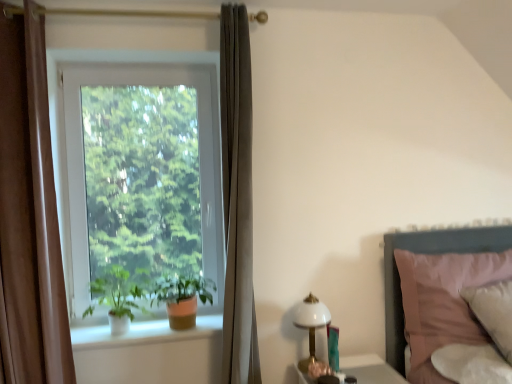
The width and height of the screenshot is (512, 384). Describe the element at coordinates (370, 369) in the screenshot. I see `white glossy table at lower right` at that location.

The width and height of the screenshot is (512, 384). What do you see at coordinates (142, 172) in the screenshot?
I see `white plastic window at left` at bounding box center [142, 172].

What is the approximate width of brown velvet curtain at left?

20.61 centimeters.

The height and width of the screenshot is (384, 512). In order to click on white ceramic window sill at lower left in this screenshot , I will do `click(143, 333)`.

Image resolution: width=512 pixels, height=384 pixels. I want to click on pink fabric bed at right, so click(428, 252).

What is the approximate width of white glass lampshade at right?

The width of white glass lampshade at right is 18.99 centimeters.

Where is `white glass lampshade at right`? This screenshot has width=512, height=384. white glass lampshade at right is located at coordinates [311, 324].

What do you see at coordinates (182, 297) in the screenshot? This screenshot has width=512, height=384. I see `green matte plant at window, positioned as the first houseplant in right-to-left order` at bounding box center [182, 297].

Identify the location of white matte plant at window, which is the second houseplant in right-to-left order. Image resolution: width=512 pixels, height=384 pixels. (118, 297).

Where is `white glossy table at lower right`? Image resolution: width=512 pixels, height=384 pixels. white glossy table at lower right is located at coordinates (370, 369).

In the scene shown: Can you confirm if brown velvet curtain at left is shorter than white glossy table at lower right?

In fact, brown velvet curtain at left may be taller than white glossy table at lower right.

Does brown velvet curtain at left turn towards white glossy table at lower right?

No.

Based on their sizes in the image, would you say brown velvet curtain at left is bigger or smaller than white glossy table at lower right?

In the image, brown velvet curtain at left appears to be larger than white glossy table at lower right.

Is white glass lampshade at right shorter than white matte plant at window, the first houseplant when ordered from left to right?

No.

Is white glass lampshade at right looking in the opposite direction of white matte plant at window, which is the second houseplant in right-to-left order?

No, white glass lampshade at right's orientation is not away from white matte plant at window, which is the second houseplant in right-to-left order.

This screenshot has width=512, height=384. I want to click on bedside lamp to the right of white matte plant at window, which is the second houseplant in right-to-left order, so click(311, 324).

Is brown velvet curtain at left taller than green matte plant at window, positioned as the first houseplant in right-to-left order?

Yes, brown velvet curtain at left is taller than green matte plant at window, positioned as the first houseplant in right-to-left order.

Looking at this image, how distant is brown velvet curtain at left from green matte plant at window, which ranks as the second houseplant in left-to-right order?

brown velvet curtain at left is 27.41 inches away from green matte plant at window, which ranks as the second houseplant in left-to-right order.

Considering the sizes of objects brown velvet curtain at left and green matte plant at window, which ranks as the second houseplant in left-to-right order, in the image provided, who is thinner, brown velvet curtain at left or green matte plant at window, which ranks as the second houseplant in left-to-right order,?

brown velvet curtain at left is thinner.

Is the position of brown velvet curtain at left more distant than that of green matte plant at window, positioned as the first houseplant in right-to-left order?

No, it is in front of green matte plant at window, positioned as the first houseplant in right-to-left order.

Is white ceramic window sill at lower left facing towards white matte plant at window, the first houseplant when ordered from left to right?

No, white ceramic window sill at lower left is not turned towards white matte plant at window, the first houseplant when ordered from left to right.

Considering the sizes of objects white ceramic window sill at lower left and white matte plant at window, which is the second houseplant in right-to-left order, in the image provided, who is wider, white ceramic window sill at lower left or white matte plant at window, which is the second houseplant in right-to-left order,?

Wider between the two is white ceramic window sill at lower left.

Is white ceramic window sill at lower left inside or outside of white matte plant at window, the first houseplant when ordered from left to right?

white ceramic window sill at lower left is spatially situated outside white matte plant at window, the first houseplant when ordered from left to right.

Visually, is white ceramic window sill at lower left positioned to the left or to the right of white matte plant at window, which is the second houseplant in right-to-left order?

In the image, white ceramic window sill at lower left appears on the right side of white matte plant at window, which is the second houseplant in right-to-left order.

Is brown velvet curtain at left facing away from white matte plant at window, the first houseplant when ordered from left to right?

No.

Considering the points (16, 129) and (121, 322), which point is in front, point (16, 129) or point (121, 322)?

Positioned in front is point (16, 129).

Can you confirm if brown velvet curtain at left is wider than white matte plant at window, the first houseplant when ordered from left to right?

Incorrect, the width of brown velvet curtain at left does not surpass that of white matte plant at window, the first houseplant when ordered from left to right.

Considering the sizes of objects brown velvet curtain at left and white matte plant at window, which is the second houseplant in right-to-left order, in the image provided, who is smaller, brown velvet curtain at left or white matte plant at window, which is the second houseplant in right-to-left order,?

Smaller between the two is white matte plant at window, which is the second houseplant in right-to-left order.

You are a GUI agent. You are given a task and a screenshot of the screen. Output one action in this format:
    pyautogui.click(x=<x>, y=<y>)
    Task: Click on the table below the white ceramic window sill at lower left (from the image's perspective)
    Image resolution: width=512 pixels, height=384 pixels.
    Given the screenshot: What is the action you would take?
    pyautogui.click(x=370, y=369)

Is the depth of white ceramic window sill at lower left greater than that of white glossy table at lower right?

That is True.

Considering the sizes of white ceramic window sill at lower left and white glossy table at lower right in the image, is white ceramic window sill at lower left wider or thinner than white glossy table at lower right?

Considering their sizes, white ceramic window sill at lower left looks slimmer than white glossy table at lower right.

Which of these two, white ceramic window sill at lower left or white glossy table at lower right, stands shorter?

With less height is white glossy table at lower right.

Considering the positions of point (373, 372) and point (467, 229), is point (373, 372) closer or farther from the camera than point (467, 229)?

Point (373, 372).

Does white glossy table at lower right have a smaller size compared to pink fabric bed at right?

Yes, white glossy table at lower right is smaller than pink fabric bed at right.

Choose the correct answer: Is white glossy table at lower right inside pink fabric bed at right or outside it?

white glossy table at lower right is not enclosed by pink fabric bed at right.

Does white glossy table at lower right have a greater width compared to pink fabric bed at right?

Yes, white glossy table at lower right is wider than pink fabric bed at right.

Find the location of `table behind the brown velvet curtain at left`. table behind the brown velvet curtain at left is located at coordinates (370, 369).

Identify the location of the 2nd houseplant above the white glass lampshade at right (from a real-world perspective). The image size is (512, 384). (118, 297).

When comparing their distances from white ceramic window sill at lower left, does white glossy table at lower right or green matte plant at window, which ranks as the second houseplant in left-to-right order, seem closer?

The object closer to white ceramic window sill at lower left is green matte plant at window, which ranks as the second houseplant in left-to-right order.

Based on their spatial positions, is white ceramic window sill at lower left or pink fabric bed at right further from green matte plant at window, positioned as the first houseplant in right-to-left order?

The object further to green matte plant at window, positioned as the first houseplant in right-to-left order, is pink fabric bed at right.

Based on their spatial positions, is white glass lampshade at right or green matte plant at window, which ranks as the second houseplant in left-to-right order, further from brown velvet curtain at left?

A: Among the two, white glass lampshade at right is located further to brown velvet curtain at left.

Which object lies further to the anchor point white glossy table at lower right, white glass lampshade at right or white plastic window at left?

The object further to white glossy table at lower right is white plastic window at left.

Which object lies nearer to the anchor point green matte plant at window, which ranks as the second houseplant in left-to-right order, white ceramic window sill at lower left or white matte plant at window, the first houseplant when ordered from left to right?

white ceramic window sill at lower left is closer to green matte plant at window, which ranks as the second houseplant in left-to-right order.

Based on their spatial positions, is green matte plant at window, which ranks as the second houseplant in left-to-right order, or pink fabric bed at right closer to white glass lampshade at right?

green matte plant at window, which ranks as the second houseplant in left-to-right order.

When comparing their distances from white glossy table at lower right, does green matte plant at window, which ranks as the second houseplant in left-to-right order, or white glass lampshade at right seem further?

The object further to white glossy table at lower right is green matte plant at window, which ranks as the second houseplant in left-to-right order.

Which object lies nearer to the anchor point white plastic window at left, green matte plant at window, positioned as the first houseplant in right-to-left order, or white glossy table at lower right?

green matte plant at window, positioned as the first houseplant in right-to-left order, lies closer to white plastic window at left than the other object.

Find the location of `table between brown velvet curtain at left and pink fabric bed at right from left to right`. table between brown velvet curtain at left and pink fabric bed at right from left to right is located at coordinates (370, 369).

Identify the location of window sill located between white matte plant at window, which is the second houseplant in right-to-left order, and green matte plant at window, positioned as the first houseplant in right-to-left order, in the left-right direction. (143, 333).

The width and height of the screenshot is (512, 384). I want to click on window sill between brown velvet curtain at left and white glass lampshade at right from left to right, so click(x=143, y=333).

You are a GUI agent. You are given a task and a screenshot of the screen. Output one action in this format:
    pyautogui.click(x=<x>, y=<y>)
    Task: Click on the curtain that lies between white plastic window at left and white matte plant at window, which is the second houseplant in right-to-left order, from top to bottom
    The height and width of the screenshot is (384, 512).
    Given the screenshot: What is the action you would take?
    pyautogui.click(x=29, y=215)